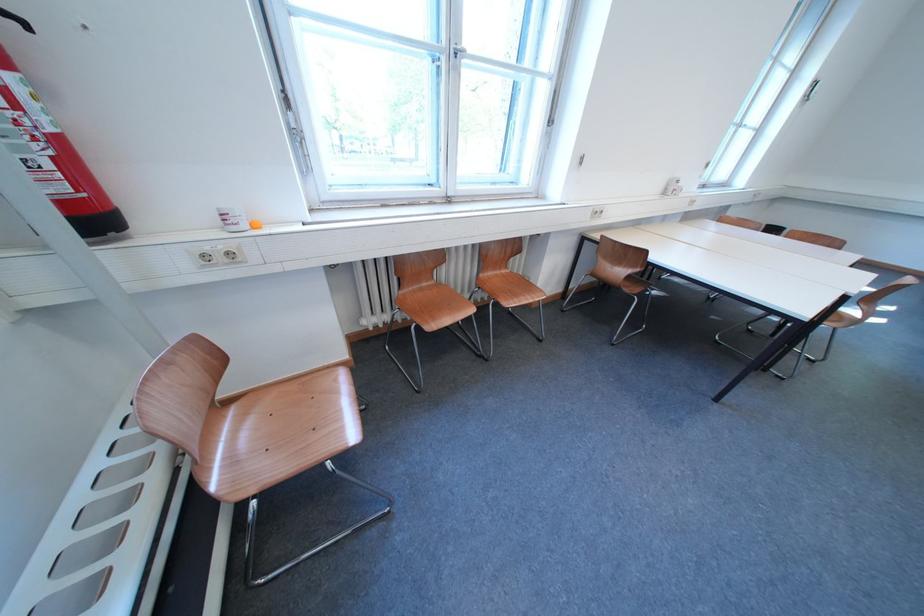
Find the location of `white paper cup`. white paper cup is located at coordinates (233, 219).